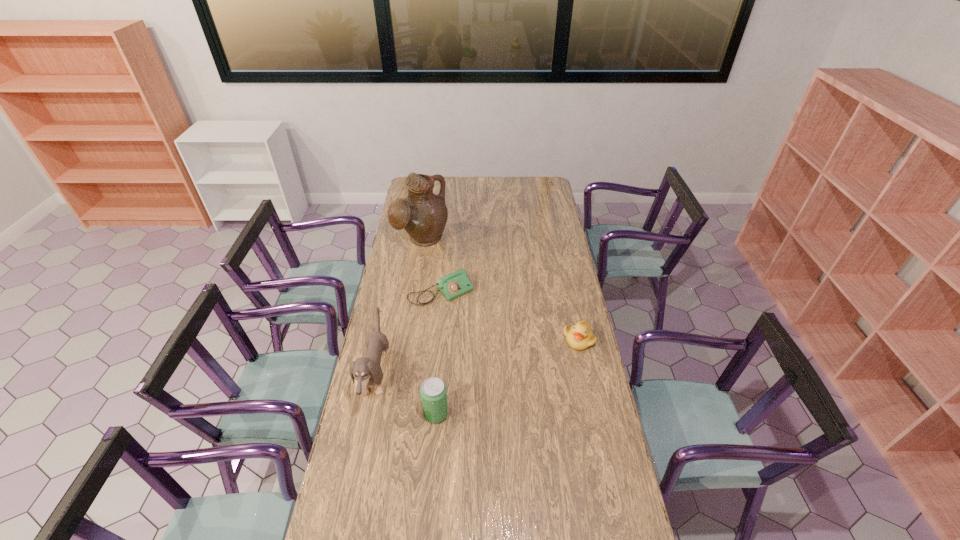
This screenshot has width=960, height=540. What are the coordinates of `free space on the desktop that is between the soda and the rightmost object and is positioned on the dial of the fourth nearest object` in the screenshot? It's located at (511, 375).

In order to click on free spot on the desktop that is between the soda and the rightmost object and is positioned at the spout of the farthest object in this screenshot , I will do `click(531, 364)`.

The width and height of the screenshot is (960, 540). I want to click on free space on the desktop that is between the third shortest object and the rightmost object and is positioned at the face of the puppy, so click(x=507, y=377).